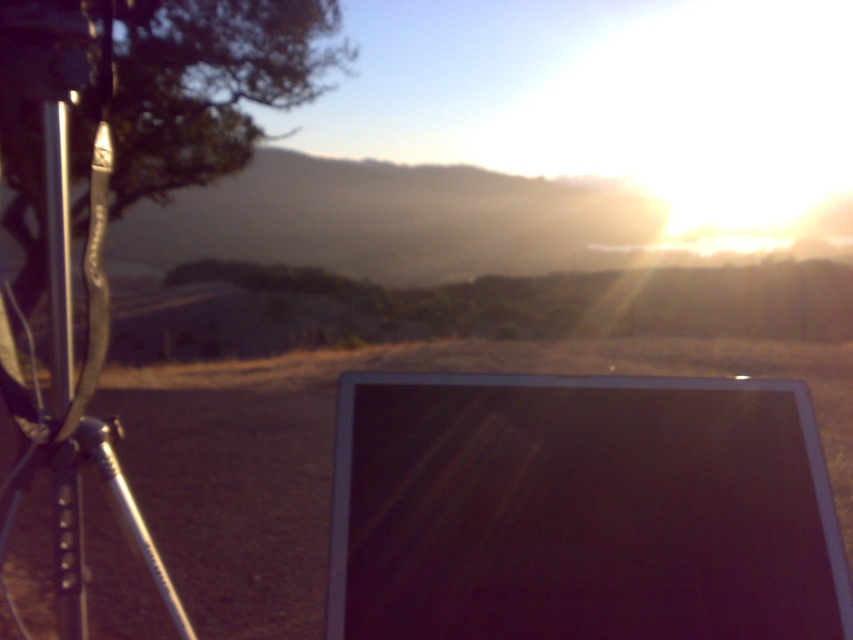
Looking at this image, you are setting up equipment for a photoshoot and need to place a camera bag between the silver metallic tripod at left and the metallic silver pole at left. Given their sizes, which object should you place the bag closer to to ensure it doesn

The silver metallic tripod at left has a larger width than the metallic silver pole at left, so placing the camera bag closer to the tripod would provide more space between the two objects.

You are a photographer setting up equipment in the scene. You notice the silver metallic tripod at left and the metallic silver pole at left. Which object is closer to you?

The silver metallic tripod at left is positioned over the metallic silver pole at left, meaning it is closer to you.

You are a photographer setting up equipment for a sunrise shot. You have a silver metallic tripod at left and a metallic silver pole at left. Which object is closer to the center of the image?

The silver metallic tripod at left is positioned on the right side of metallic silver pole at left, so the tripod is closer to the center of the image than the pole.